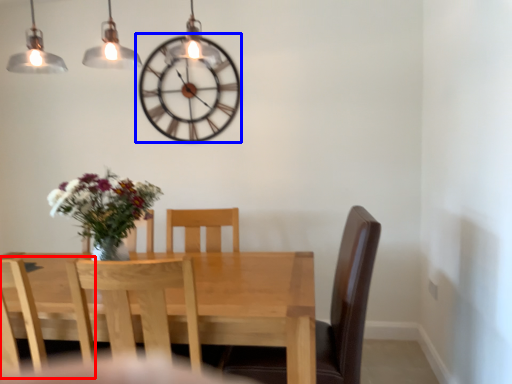
Question: Which point is further to the camera, chair (highlighted by a red box) or wall clock (highlighted by a blue box)?

Choices:
 (A) chair
 (B) wall clock

Answer: (B)